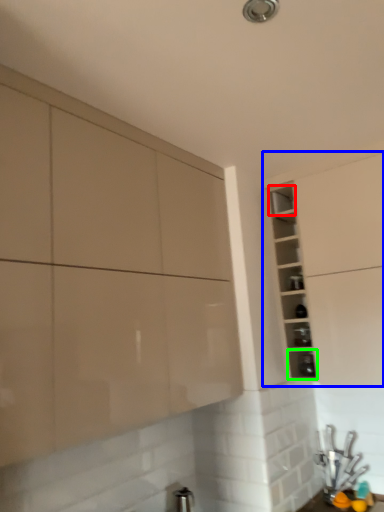
Question: Which object is positioned closest to shelf (highlighted by a red box)? Select from cabinetry (highlighted by a blue box) and shelf (highlighted by a green box).

Choices:
 (A) cabinetry
 (B) shelf

Answer: (A)